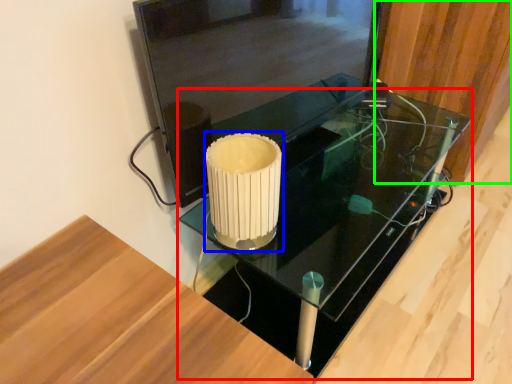
Question: Which object is positioned closest to table (highlighted by a red box)? Select from candle holder (highlighted by a blue box) and wood (highlighted by a green box).

Choices:
 (A) candle holder
 (B) wood

Answer: (B)